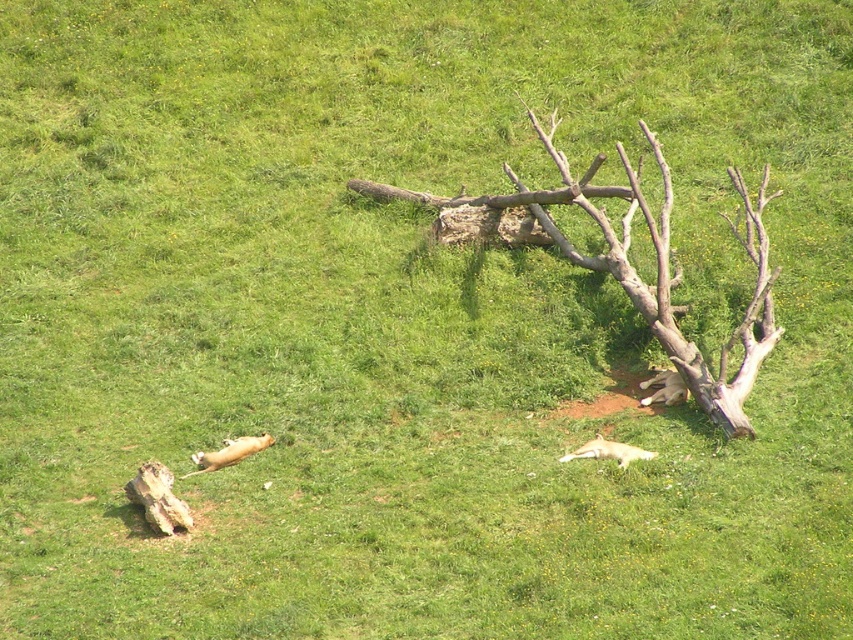
Question: Among these objects, which one is nearest to the camera?

Choices:
 (A) golden fur fox at lower left
 (B) brown fur fox at right

Answer: (A)

Question: Is golden fur fox at lower left above brown fur fox at right?

Choices:
 (A) no
 (B) yes

Answer: (A)

Question: Is golden fur fox at lower left further to the viewer compared to golden fur fox at lower center?

Choices:
 (A) yes
 (B) no

Answer: (A)

Question: Which object is the closest to the brown rough wood at center?

Choices:
 (A) golden fur fox at lower left
 (B) golden fur fox at lower center

Answer: (B)

Question: Among these points, which one is nearest to the camera?

Choices:
 (A) (236, 456)
 (B) (648, 451)
 (C) (357, 179)
 (D) (659, 397)

Answer: (B)

Question: Can you confirm if brown rough wood at center is thinner than golden fur fox at lower center?

Choices:
 (A) no
 (B) yes

Answer: (A)